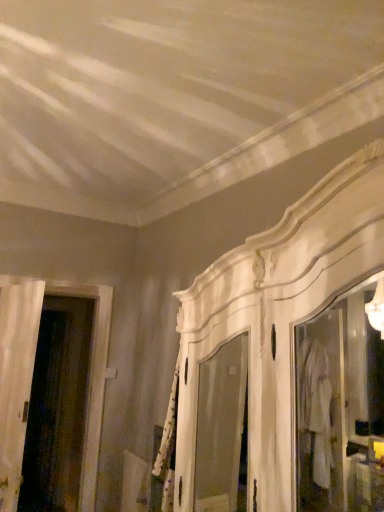
Question: Is white wood door at left oriented towards transparent glass screen door at left?

Choices:
 (A) no
 (B) yes

Answer: (A)

Question: From the image's perspective, would you say white wood door at left is positioned over transparent glass screen door at left?

Choices:
 (A) yes
 (B) no

Answer: (A)

Question: Considering the relative sizes of white wood door at left and transparent glass screen door at left in the image provided, is white wood door at left shorter than transparent glass screen door at left?

Choices:
 (A) yes
 (B) no

Answer: (A)

Question: Can you confirm if white wood door at left is positioned to the right of transparent glass screen door at left?

Choices:
 (A) yes
 (B) no

Answer: (A)

Question: Is white wood door at left at the left side of transparent glass screen door at left?

Choices:
 (A) no
 (B) yes

Answer: (A)

Question: Would you say white wood door at left is a long distance from transparent glass screen door at left?

Choices:
 (A) no
 (B) yes

Answer: (B)

Question: Does transparent glass screen door at left appear on the left side of white wood door at left?

Choices:
 (A) no
 (B) yes

Answer: (B)

Question: Does transparent glass screen door at left come behind white wood door at left?

Choices:
 (A) yes
 (B) no

Answer: (A)

Question: Does transparent glass screen door at left appear on the right side of white wood door at left?

Choices:
 (A) yes
 (B) no

Answer: (B)

Question: Does transparent glass screen door at left turn towards white wood door at left?

Choices:
 (A) no
 (B) yes

Answer: (A)

Question: Can you confirm if transparent glass screen door at left is bigger than white wood door at left?

Choices:
 (A) yes
 (B) no

Answer: (A)

Question: From the image's perspective, is transparent glass screen door at left on top of white wood door at left?

Choices:
 (A) no
 (B) yes

Answer: (A)

Question: Is transparent glass screen door at left situated inside white wood door at left or outside?

Choices:
 (A) inside
 (B) outside

Answer: (B)